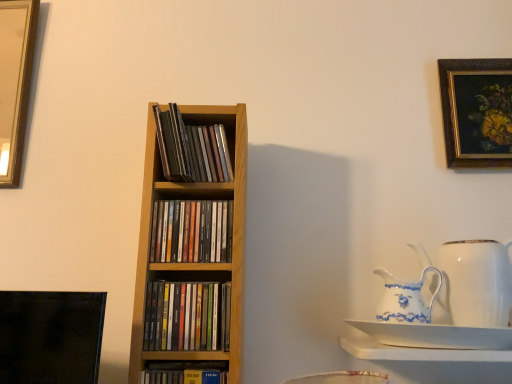
Question: Is white porcelain jug at right, the second jug viewed from the left, taller or shorter than multicolored paper books at center, which is the 3th book in top-to-bottom order?

Choices:
 (A) tall
 (B) short

Answer: (A)

Question: Considering their positions, is white porcelain jug at right, the second jug viewed from the left, located in front of or behind multicolored paper books at center, positioned as the second book in bottom-to-top order?

Choices:
 (A) behind
 (B) front

Answer: (A)

Question: Which is farther from the wooden cd case at center, the 2th book from the top?

Choices:
 (A) white glossy shelf at lower right
 (B) matte black book at lower center, the first book in the bottom-to-top sequence
 (C) white porcelain jug at right, which is the 1th jug from right to left
 (D) wooden cd case at center, the first book from the top
 (E) gold-framed painting at upper right

Answer: (E)

Question: Considering the real-world distances, which object is farthest from the matte black book at lower center, the first book in the bottom-to-top sequence?

Choices:
 (A) gold-framed painting at upper right
 (B) white porcelain saucer at lower right
 (C) wooden cd case at center, the third book in the bottom-to-top sequence
 (D) wooden cd case at center, the fourth book ordered from the bottom
 (E) white porcelain jug at right, the 1th jug when ordered from left to right

Answer: (A)